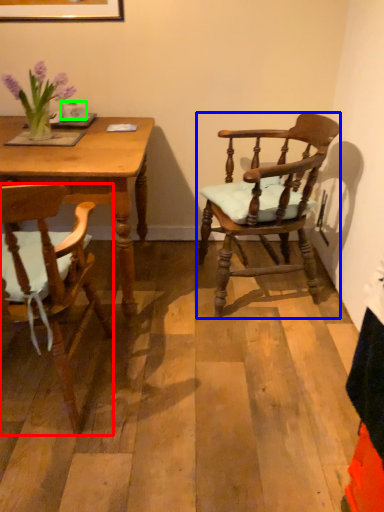
Question: Which object is the closest to the chair (highlighted by a red box)? Choose among these: chair (highlighted by a blue box) or coffee cup (highlighted by a green box).

Choices:
 (A) chair
 (B) coffee cup

Answer: (A)